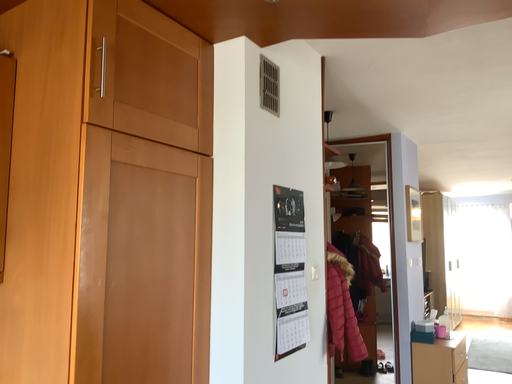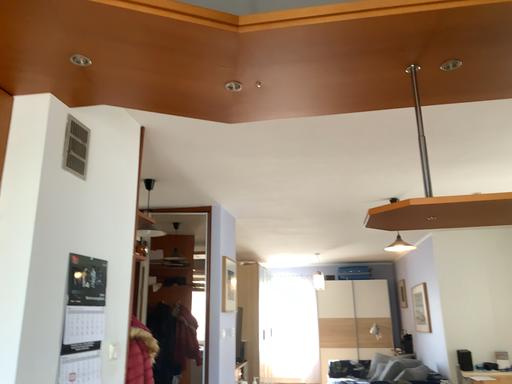
Question: How did the camera likely rotate when shooting the video?

Choices:
 (A) rotated downward
 (B) rotated upward

Answer: (B)